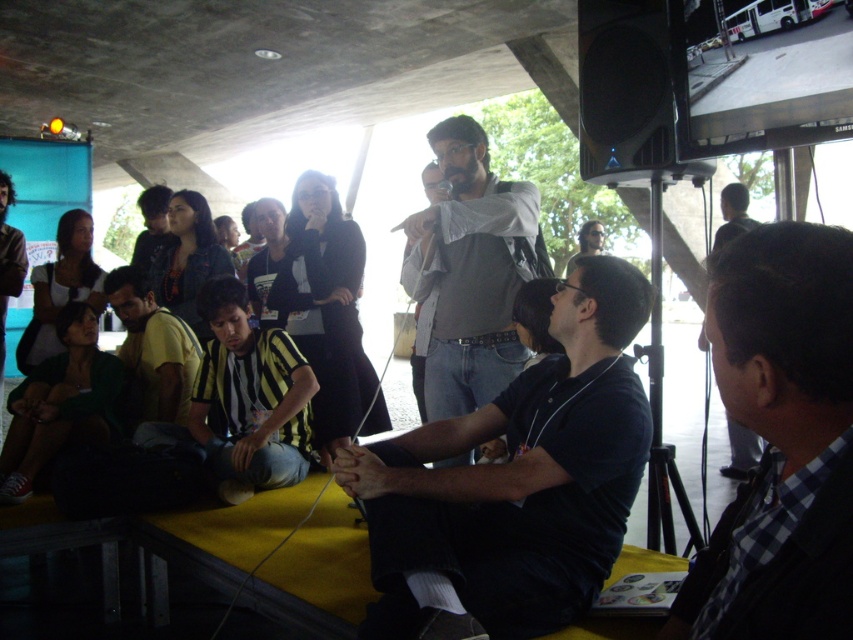
You are attending a public event and see two people in the scene described. The first person is wearing a black matte shirt at center, and the second is wearing a black checkered shirt at lower right. Which of these two individuals is larger in size?

The black matte shirt at center is bigger than the black checkered shirt at lower right, so the individual wearing the black matte shirt at center is larger in size.